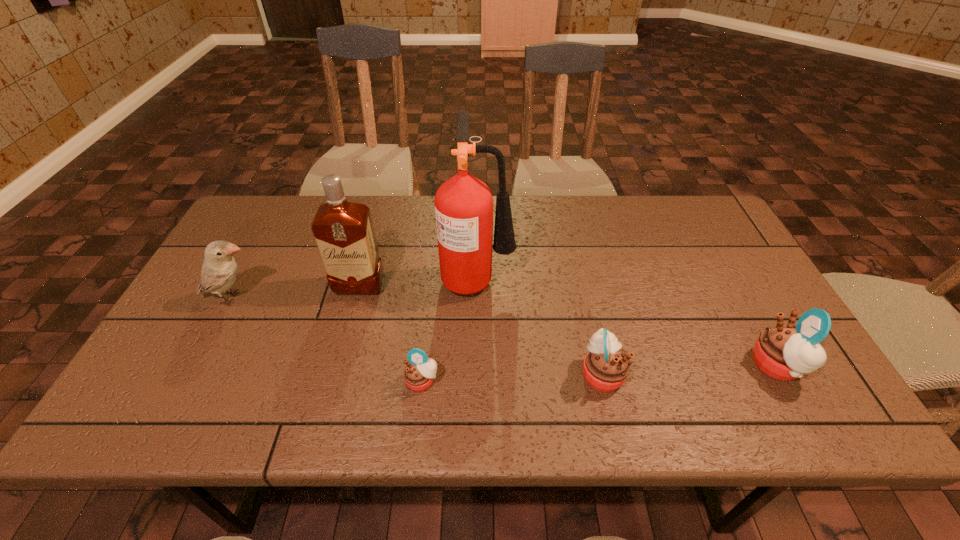
Locate an element on the screen. The width and height of the screenshot is (960, 540). vacant space at the near edge of the desktop is located at coordinates (341, 379).

Where is `vacant region at the right edge of the desktop`? Image resolution: width=960 pixels, height=540 pixels. vacant region at the right edge of the desktop is located at coordinates (700, 247).

You are a GUI agent. You are given a task and a screenshot of the screen. Output one action in this format:
    pyautogui.click(x=<x>, y=<y>)
    Task: Click on the free spot at the far left corner of the desktop
    The height and width of the screenshot is (540, 960).
    Given the screenshot: What is the action you would take?
    pyautogui.click(x=253, y=208)

Locate an element on the screen. free spot at the near left corner of the desktop is located at coordinates (187, 387).

At what (x,y) coordinates should I click in order to perform the action: click on blank region between the tallest object and the rightmost object. Please return your answer as a coordinate pair (x, y). Looking at the image, I should click on (627, 321).

Identify the location of vacant area that lies between the second shortest object and the rightmost object. (689, 370).

You are a GUI agent. You are given a task and a screenshot of the screen. Output one action in this format:
    pyautogui.click(x=<x>, y=<y>)
    Task: Click on the vacant space that is in between the liquor and the fire extinguisher
    The image size is (960, 540).
    Given the screenshot: What is the action you would take?
    pyautogui.click(x=419, y=281)

Locate an element on the screen. Image resolution: width=960 pixels, height=540 pixels. free space between the bird and the shortest muffin is located at coordinates (x=327, y=340).

This screenshot has height=540, width=960. In order to click on free space between the bird and the leftmost muffin in this screenshot , I will do `click(327, 340)`.

Locate an element on the screen. The height and width of the screenshot is (540, 960). vacant space that's between the rightmost object and the fire extinguisher is located at coordinates pyautogui.click(x=627, y=321).